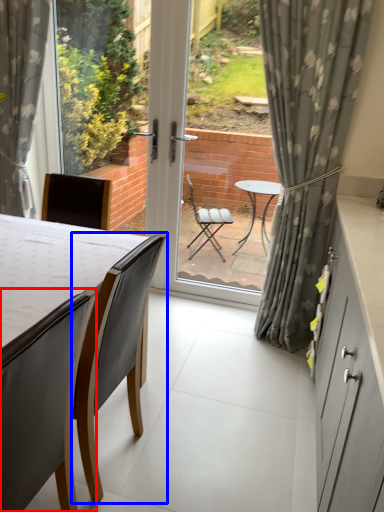
Question: Which object appears farthest to the camera in this image, chair (highlighted by a red box) or chair (highlighted by a blue box)?

Choices:
 (A) chair
 (B) chair

Answer: (B)